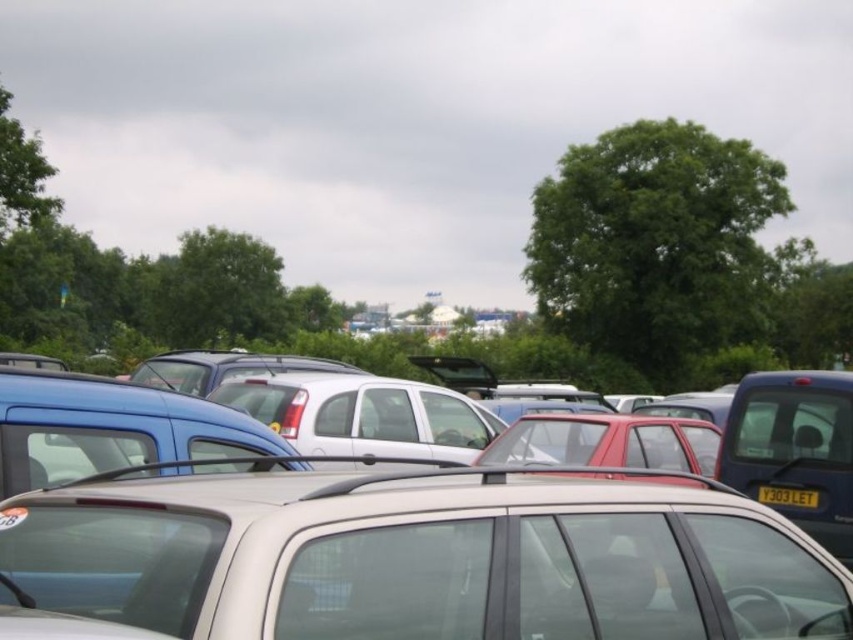
Does satin silver car at center have a lesser width compared to yellow matte license plate at center?

Incorrect, satin silver car at center's width is not less than yellow matte license plate at center's.

Which is in front, point (381, 637) or point (785, 493)?

Positioned in front is point (381, 637).

Between point (541, 570) and point (798, 500), which one is positioned in front?

Point (541, 570) is in front.

Find the location of `satin silver car at center`. satin silver car at center is located at coordinates (421, 557).